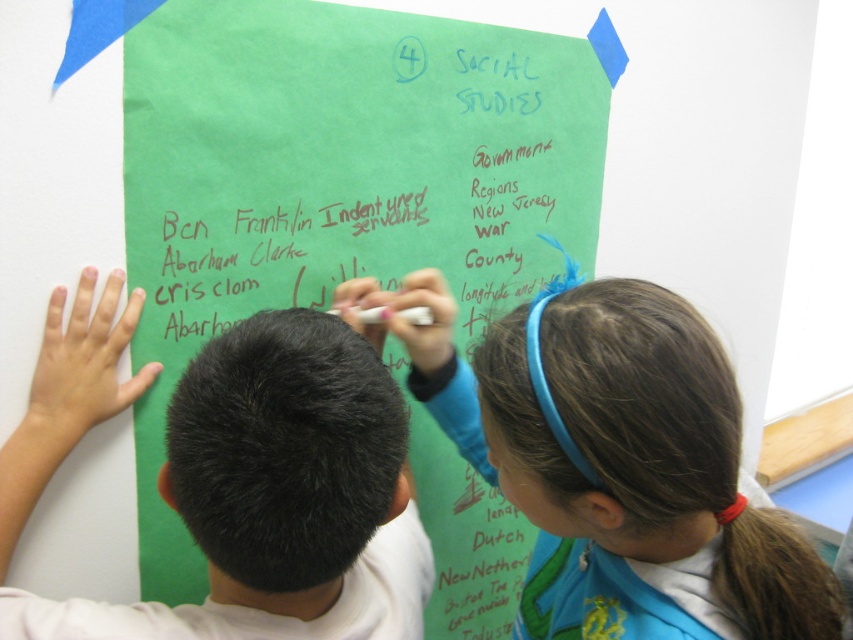
Question: Which of the following is the farthest from the observer?

Choices:
 (A) green paper at center
 (B) black hair at center
 (C) light brown hair at upper center

Answer: (A)

Question: In this image, where is green paper at center located relative to light brown hair at upper center?

Choices:
 (A) right
 (B) left

Answer: (B)

Question: Does light brown hair at upper center come behind black hair at center?

Choices:
 (A) no
 (B) yes

Answer: (B)

Question: Does green paper at center appear under light brown hair at upper center?

Choices:
 (A) yes
 (B) no

Answer: (B)

Question: Which point appears closest to the camera in this image?

Choices:
 (A) (338, 579)
 (B) (341, 92)

Answer: (A)

Question: Which of the following is the closest to the observer?

Choices:
 (A) black hair at center
 (B) green paper at center
 (C) light brown hair at upper center

Answer: (A)